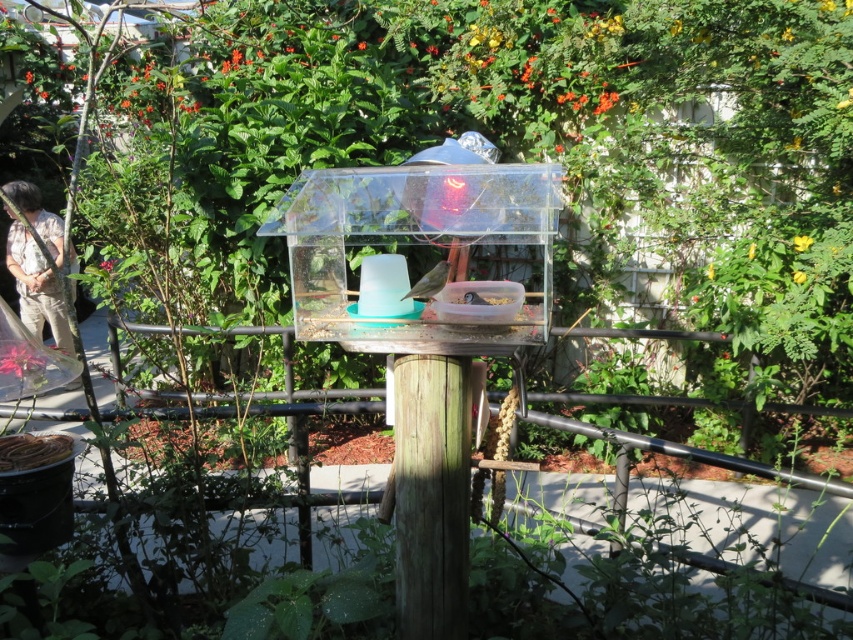
Is transparent plastic bird feeder at center thinner than weathered wood pole at center?

No.

Which is more to the right, transparent plastic bird feeder at center or weathered wood pole at center?

weathered wood pole at center is more to the right.

Does point (318, 195) lie behind point (428, 541)?

No, (318, 195) is closer to viewer.

Where is `transparent plastic bird feeder at center`? The height and width of the screenshot is (640, 853). transparent plastic bird feeder at center is located at coordinates (422, 243).

Is weathered wood pole at center smaller than brown matte bird at center?

No, weathered wood pole at center is not smaller than brown matte bird at center.

Can you confirm if weathered wood pole at center is bigger than brown matte bird at center?

Yes.

Locate an element on the screen. The height and width of the screenshot is (640, 853). weathered wood pole at center is located at coordinates (431, 493).

Who is positioned more to the left, transparent plastic bird feeder at center or smooth gray bird at center?

Positioned to the left is transparent plastic bird feeder at center.

Between transparent plastic bird feeder at center and smooth gray bird at center, which one is positioned lower?

smooth gray bird at center is below.

Is point (509, 230) more distant than point (468, 300)?

That is False.

Locate an element on the screen. The width and height of the screenshot is (853, 640). transparent plastic bird feeder at center is located at coordinates (422, 243).